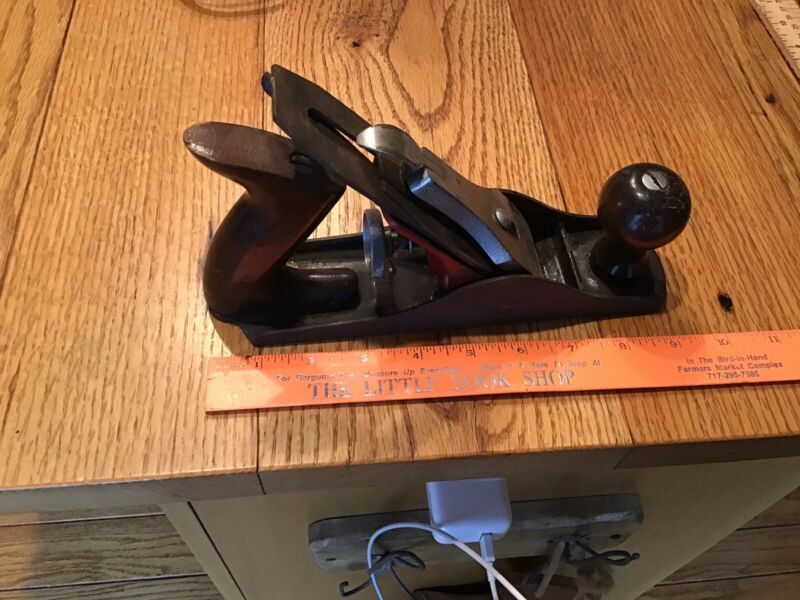
Where is `charger`? charger is located at coordinates (476, 507).